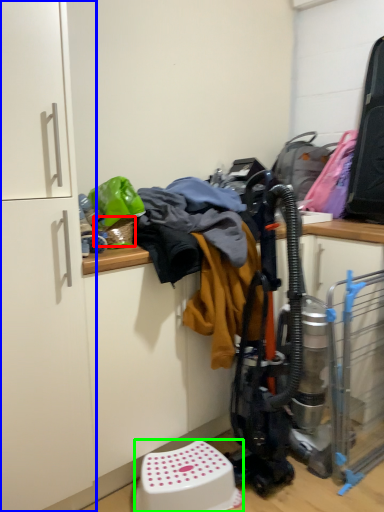
Question: Based on their relative distances, which object is farther from basket (highlighted by a red box)? Choose from cabinetry (highlighted by a blue box) and step stool (highlighted by a green box).

Choices:
 (A) cabinetry
 (B) step stool

Answer: (B)